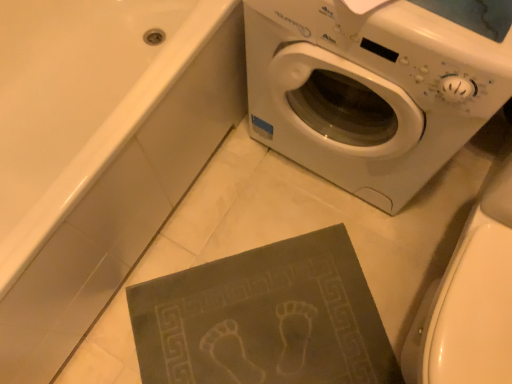
The width and height of the screenshot is (512, 384). Find the location of `vacant space behind dark gray textured mat at lower center`. vacant space behind dark gray textured mat at lower center is located at coordinates (254, 210).